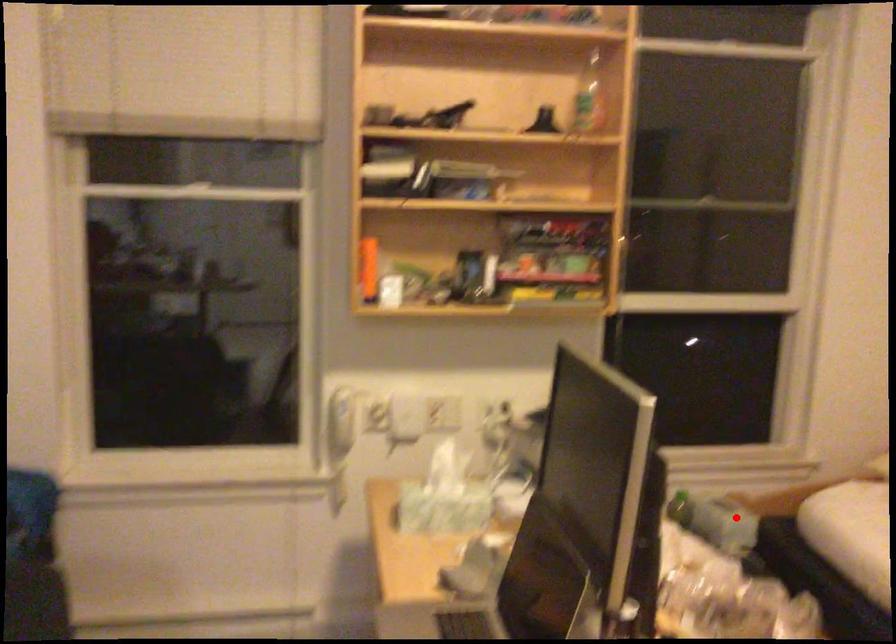
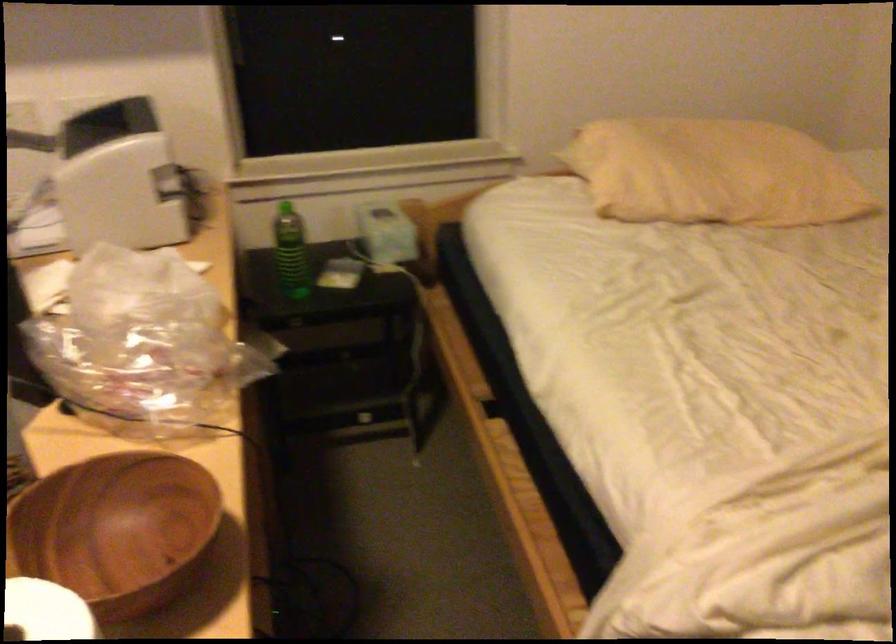
Question: I am providing you with two images of the same scene from different viewpoints. Given a red point in image1, look at the same physical point in image2. Is it:

Choices:
 (A) Closer to the viewpoint
 (B) Farther from the viewpoint

Answer: (A)